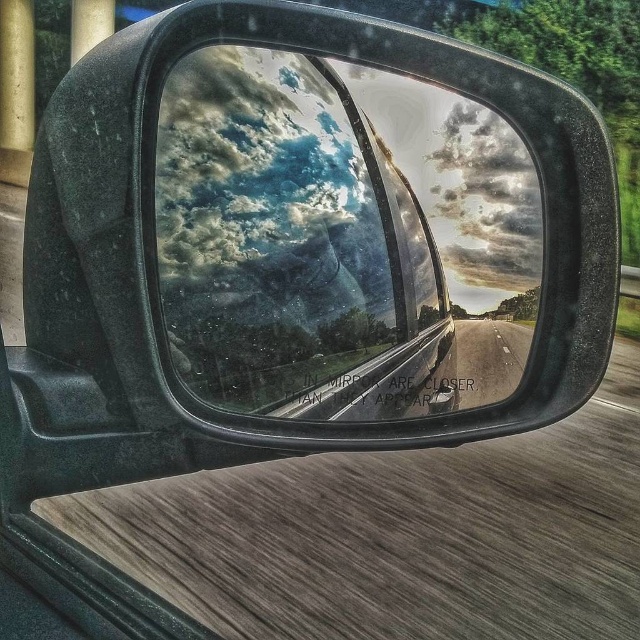
Question: Is transparent glass car window at center to the left of asphalt road at center from the viewer's perspective?

Choices:
 (A) yes
 (B) no

Answer: (A)

Question: Does transparent glass car window at center lie in front of asphalt road at center?

Choices:
 (A) yes
 (B) no

Answer: (A)

Question: Is transparent glass car window at center positioned before asphalt road at center?

Choices:
 (A) no
 (B) yes

Answer: (B)

Question: Which of the following is the farthest from the observer?

Choices:
 (A) asphalt road at center
 (B) transparent glass car window at center

Answer: (A)